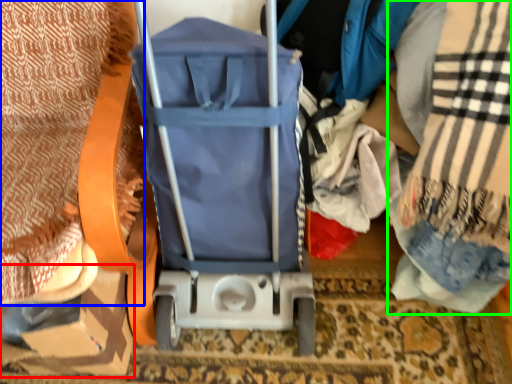
Question: Estimate the real-world distances between objects in this image. Which object is closer to cardboard box (highlighted by a red box), blanket (highlighted by a blue box) or blanket (highlighted by a green box)?

Choices:
 (A) blanket
 (B) blanket

Answer: (A)